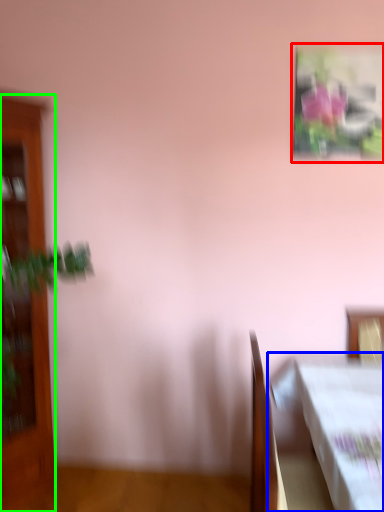
Question: Which is farther away from picture frame (highlighted by a red box)? table (highlighted by a blue box) or furniture (highlighted by a green box)?

Choices:
 (A) table
 (B) furniture

Answer: (B)